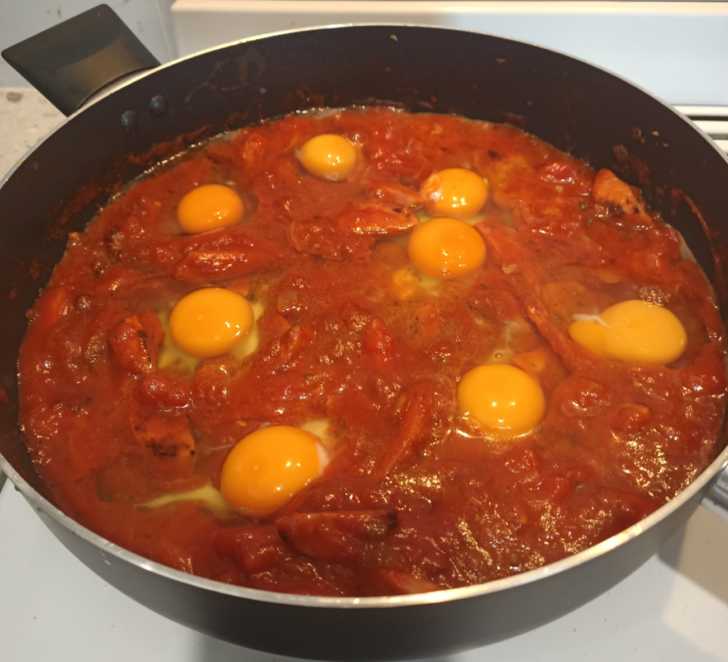
Where is `inside of cooking pan`? inside of cooking pan is located at coordinates (464, 73).